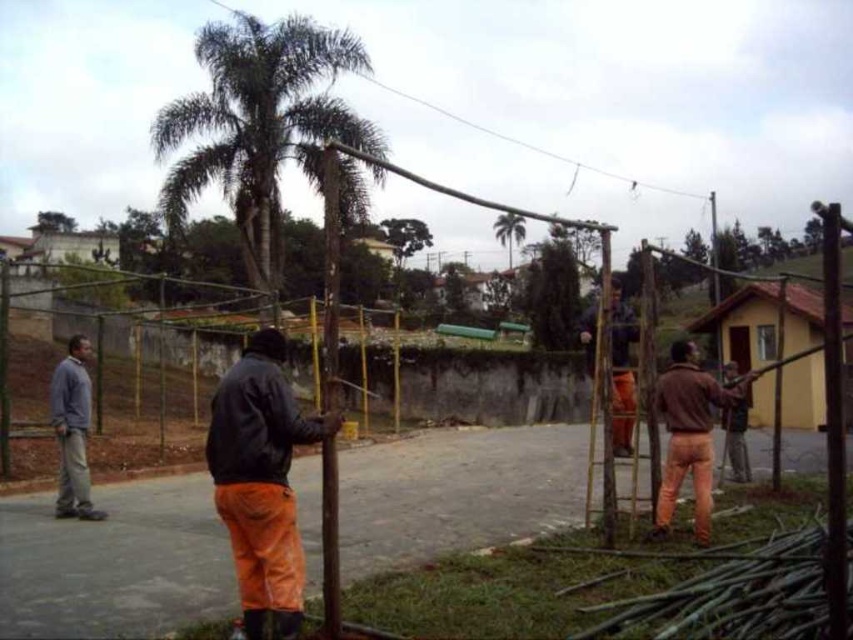
Does orange fabric construction worker at center appear over green leafy tree at upper center?

No, orange fabric construction worker at center is not above green leafy tree at upper center.

Consider the image. Is orange fabric construction worker at center positioned behind green leafy tree at upper center?

No, orange fabric construction worker at center is in front of green leafy tree at upper center.

Is point (589, 362) farther from camera compared to point (39, 220)?

No, (589, 362) is closer to viewer.

Locate an element on the screen. orange fabric construction worker at center is located at coordinates (621, 371).

Can you confirm if brown wooden pole at upper center is smaller than green leafy tree at upper center?

Actually, brown wooden pole at upper center might be larger than green leafy tree at upper center.

Does brown wooden pole at upper center have a larger size compared to green leafy tree at upper center?

Yes.

Locate an element on the screen. brown wooden pole at upper center is located at coordinates (537, 145).

Locate an element on the screen. This screenshot has height=640, width=853. brown wooden pole at upper center is located at coordinates (537, 145).

Does brown matte construction worker at right have a lesser height compared to green leafy palm tree at upper center?

Yes, brown matte construction worker at right is shorter than green leafy palm tree at upper center.

Is brown matte construction worker at right to the right of green leafy palm tree at upper center from the viewer's perspective?

No, brown matte construction worker at right is not to the right of green leafy palm tree at upper center.

Identify the location of brown matte construction worker at right. The image size is (853, 640). (735, 422).